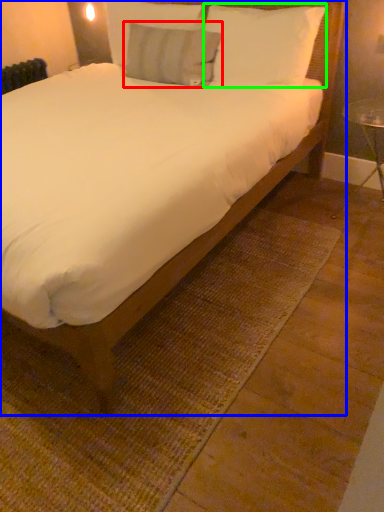
Question: Which object is positioned closest to pillow (highlighted by a red box)? Select from bed (highlighted by a blue box) and pillow (highlighted by a green box).

Choices:
 (A) bed
 (B) pillow

Answer: (B)